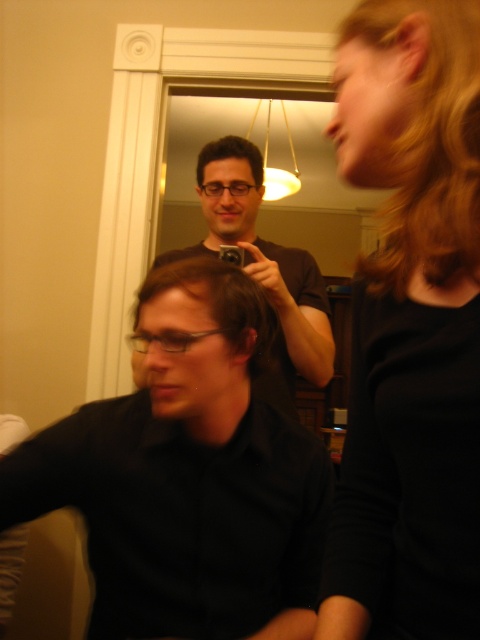
Question: Based on their relative distances, which object is farther from the black matte hair at upper right?

Choices:
 (A) brown matte hair at center
 (B) dark brown hair at upper center

Answer: (B)

Question: Is black matte hair at upper right above blonde curly hair at upper right?

Choices:
 (A) no
 (B) yes

Answer: (A)

Question: Which point is closer to the camera taking this photo?

Choices:
 (A) (354, 106)
 (B) (464, 54)
 (C) (235, 339)
 (D) (326, 301)

Answer: (B)

Question: Does black matte hair at upper right appear over blonde curly hair at upper right?

Choices:
 (A) yes
 (B) no

Answer: (B)

Question: Observing the image, what is the correct spatial positioning of black matte hair at upper right in reference to dark brown hair at upper center?

Choices:
 (A) left
 (B) right

Answer: (B)

Question: Which point is closer to the camera?

Choices:
 (A) brown matte hair at center
 (B) black matte hair at upper right

Answer: (B)